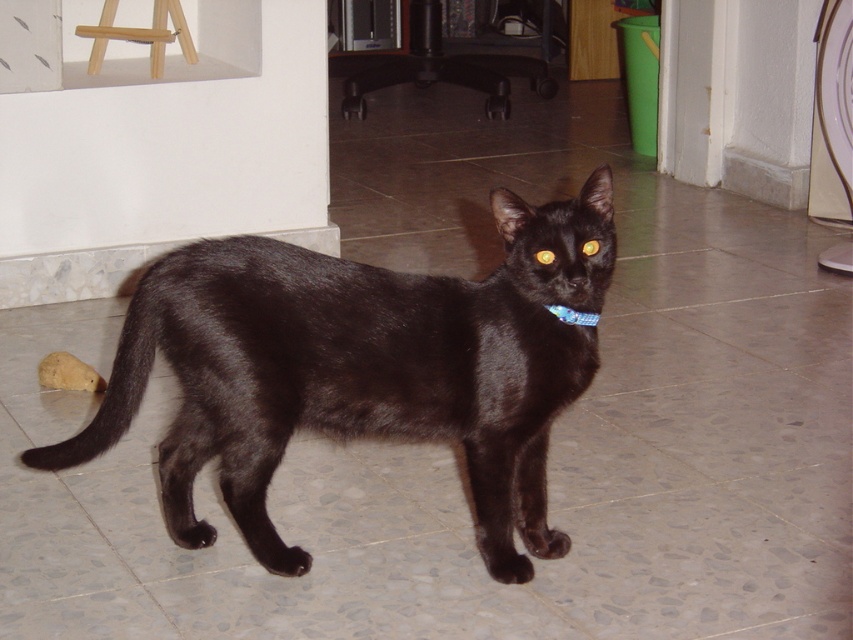
You are a robot navigating the room where the black cat is standing. You need to move from point A to point B. Point A is at coordinates point (169, 481) and point B is at coordinates point (158, 19). According to the scene description, which point is closer to the black cat?

Point (169, 481) is in front of point (158, 19), so the black cat is closer to point A at (169, 481) than point B at (158, 19).

You are a pet sitter who needs to place a small toy for the shiny black cat at center. Where should you place it so that the cat can easily see the toy from its current position, considering the light brown wooden stool at upper left?

The shiny black cat at center is below the light brown wooden stool at upper left, so placing the toy in front of the cat and away from the stool would ensure the cat has an unobstructed view.

You are a pet photographer aiming to capture the cat from above. You notice the blue fabric neckband at center and the yellow shiny eye at center. Which object is positioned lower in the image?

The blue fabric neckband at center is located below the yellow shiny eye at center, so the blue fabric neckband at center is positioned lower in the image.